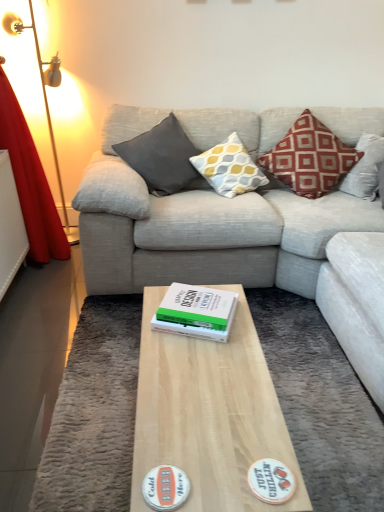
Question: From the image's perspective, is matte gray cushion at center, arranged as the 3th pillow when viewed from the right, below red velvet curtain at left?

Choices:
 (A) yes
 (B) no

Answer: (B)

Question: Can you confirm if matte gray cushion at center, arranged as the 3th pillow when viewed from the right, is taller than red velvet curtain at left?

Choices:
 (A) no
 (B) yes

Answer: (A)

Question: Are matte gray cushion at center, arranged as the 3th pillow when viewed from the right, and red velvet curtain at left located far from each other?

Choices:
 (A) no
 (B) yes

Answer: (A)

Question: Is the depth of matte gray cushion at center, arranged as the 3th pillow when viewed from the right, less than that of red velvet curtain at left?

Choices:
 (A) yes
 (B) no

Answer: (B)

Question: Is matte gray cushion at center, arranged as the 3th pillow when viewed from the right, further to camera compared to red velvet curtain at left?

Choices:
 (A) no
 (B) yes

Answer: (B)

Question: Which is correct: matte gray cushion at center, arranged as the 3th pillow when viewed from the right, is inside red cotton pillow at upper right, positioned as the 3th pillow in left-to-right order, or outside of it?

Choices:
 (A) inside
 (B) outside

Answer: (B)

Question: Is point (178, 141) closer or farther from the camera than point (334, 185)?

Choices:
 (A) farther
 (B) closer

Answer: (B)

Question: In terms of width, does matte gray cushion at center, arranged as the 3th pillow when viewed from the right, look wider or thinner when compared to red cotton pillow at upper right, placed as the first pillow when sorted from right to left?

Choices:
 (A) wide
 (B) thin

Answer: (B)

Question: Is matte gray cushion at center, arranged as the 3th pillow when viewed from the right, bigger or smaller than red cotton pillow at upper right, placed as the first pillow when sorted from right to left?

Choices:
 (A) small
 (B) big

Answer: (A)

Question: From a real-world perspective, is white matte sticker at center, the second sticker in the left-to-right sequence, positioned above or below light gray fabric couch at center?

Choices:
 (A) above
 (B) below

Answer: (B)

Question: Do you think white matte sticker at center, the second sticker in the left-to-right sequence, is within light gray fabric couch at center, or outside of it?

Choices:
 (A) outside
 (B) inside

Answer: (B)

Question: In terms of height, does white matte sticker at center, the second sticker in the left-to-right sequence, look taller or shorter compared to light gray fabric couch at center?

Choices:
 (A) tall
 (B) short

Answer: (B)

Question: Considering the positions of white matte sticker at center, the second sticker in the left-to-right sequence, and light gray fabric couch at center in the image, is white matte sticker at center, the second sticker in the left-to-right sequence, bigger or smaller than light gray fabric couch at center?

Choices:
 (A) small
 (B) big

Answer: (A)

Question: From the image's perspective, relative to light gray fabric couch at center, is white paper at center above or below?

Choices:
 (A) below
 (B) above

Answer: (A)

Question: Is white paper at center situated inside light gray fabric couch at center or outside?

Choices:
 (A) inside
 (B) outside

Answer: (A)